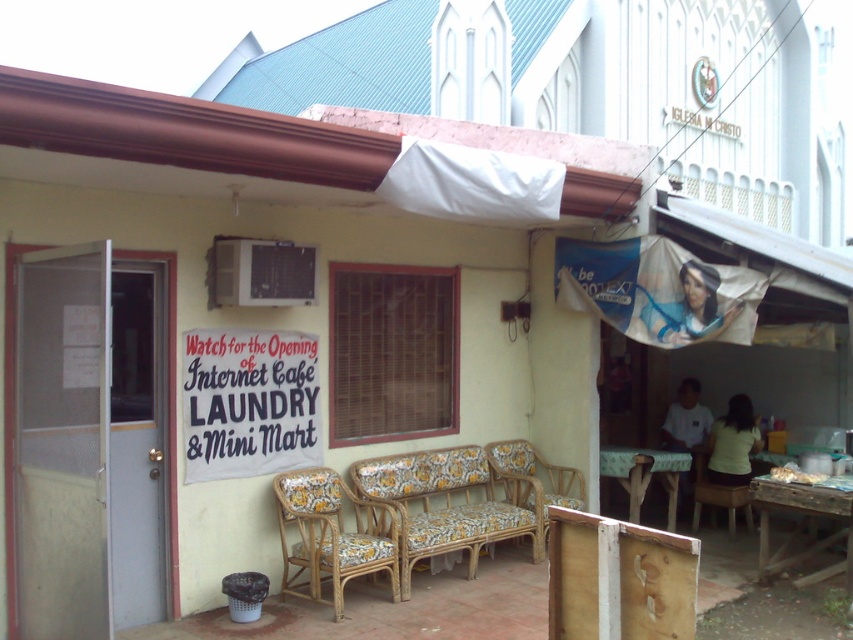
You are standing in front of the business establishment and want to locate the wooden signboard at lower right. According to the coordinates provided, where exactly is it positioned?

The wooden signboard at lower right is positioned at coordinates point (618, 579).

You are standing in front of the building and want to read the text on the wooden signboard at lower right. The floral fabric cushioned chair at center is blocking your view. Can you move the chair to get a better look at the signboard?

The wooden signboard at lower right has a lesser height compared to the floral fabric cushioned chair at center, so moving the chair might help you see the signboard better since the chair is taller and could be obstructing the view.